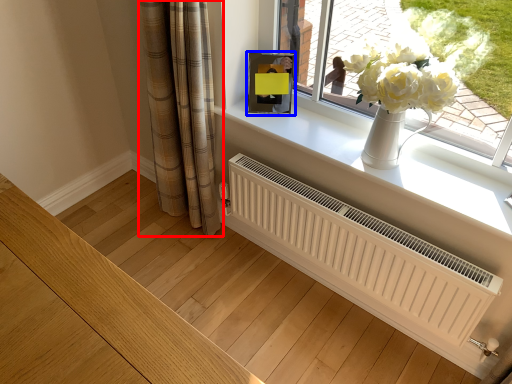
Question: Which object appears farthest to the camera in this image, curtain (highlighted by a red box) or picture frame (highlighted by a blue box)?

Choices:
 (A) curtain
 (B) picture frame

Answer: (B)